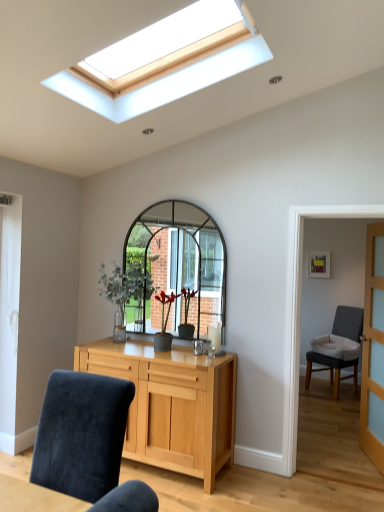
Question: Is gray fabric chair at right, the 2th chair positioned from the front, bigger or smaller than velvet blue chair at lower left, the second chair positioned from the right?

Choices:
 (A) big
 (B) small

Answer: (A)

Question: Considering the positions of point (342, 378) and point (104, 379), is point (342, 378) closer or farther from the camera than point (104, 379)?

Choices:
 (A) farther
 (B) closer

Answer: (A)

Question: Which object is the farthest from the clear glass door at right?

Choices:
 (A) gray fabric chair at right, which ranks as the second chair in left-to-right order
 (B) matte gray vase at center
 (C) light wood cabinet at center
 (D) velvet blue chair at lower left, marked as the second chair in a back-to-front arrangement
 (E) green glass vase at center

Answer: (D)

Question: Which object is the closest to the gray fabric chair at right, which ranks as the second chair in left-to-right order?

Choices:
 (A) green glass vase at center
 (B) clear glass door at right
 (C) light wood cabinet at center
 (D) velvet blue chair at lower left, marked as the second chair in a back-to-front arrangement
 (E) matte gray vase at center

Answer: (B)